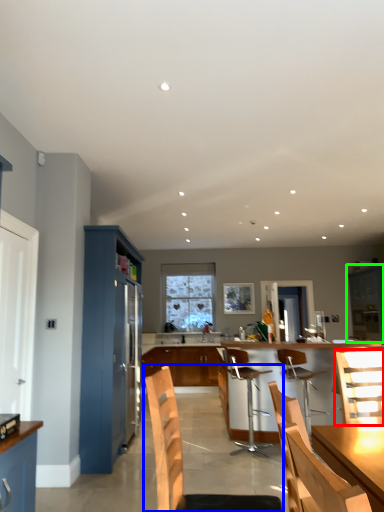
Question: Which object is the closest to the chair (highlighted by a red box)? Choose among these: chair (highlighted by a blue box) or cabinetry (highlighted by a green box).

Choices:
 (A) chair
 (B) cabinetry

Answer: (A)